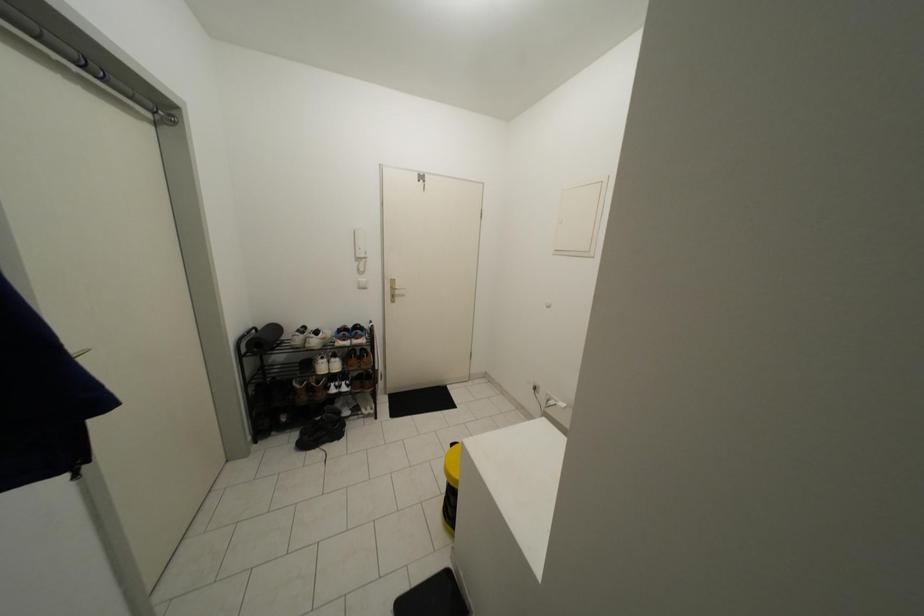
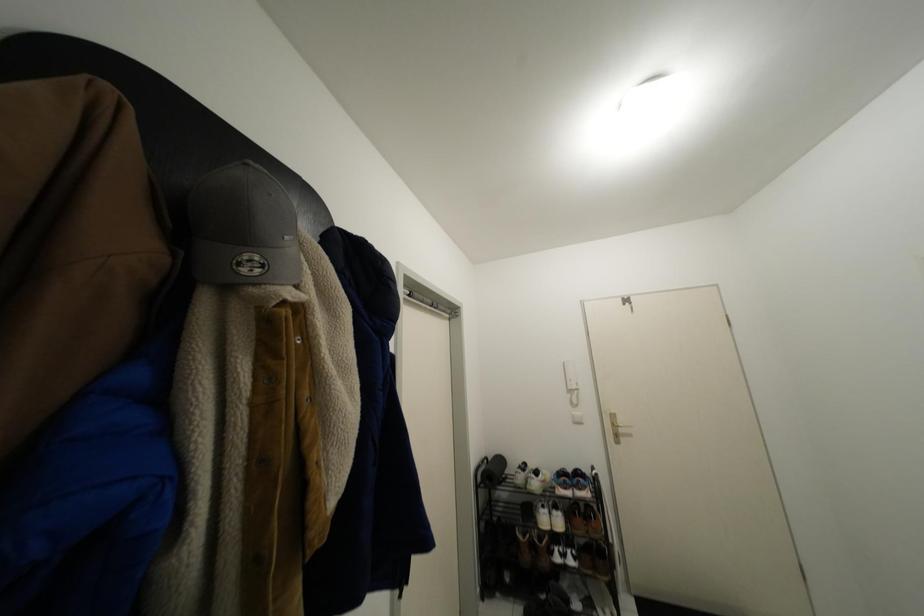
Consider the image. How did the camera likely rotate?

The camera rotated toward left-up.